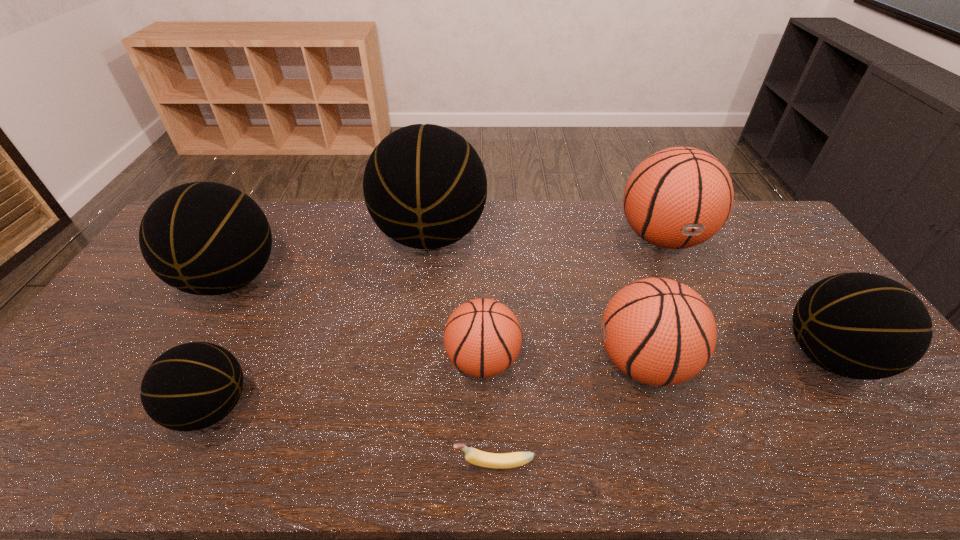
This screenshot has height=540, width=960. Identify the location of the second black basketball from right to left. (425, 186).

Locate an element on the screen. Image resolution: width=960 pixels, height=540 pixels. the tallest object is located at coordinates (425, 186).

The image size is (960, 540). I want to click on the farthest orange basketball, so click(679, 197).

In order to click on the second biggest black basketball in this screenshot , I will do `click(204, 238)`.

I want to click on the second biggest orange basketball, so click(657, 331).

What are the coordinates of `the second smallest black basketball` in the screenshot? It's located at (864, 326).

Where is `the rightmost black basketball`? The image size is (960, 540). the rightmost black basketball is located at coordinates (864, 326).

Find the location of a particular element. The image size is (960, 540). the smallest orange basketball is located at coordinates 482,337.

Find the location of a particular element. the smallest black basketball is located at coordinates (192, 386).

The height and width of the screenshot is (540, 960). I want to click on banana, so point(474,456).